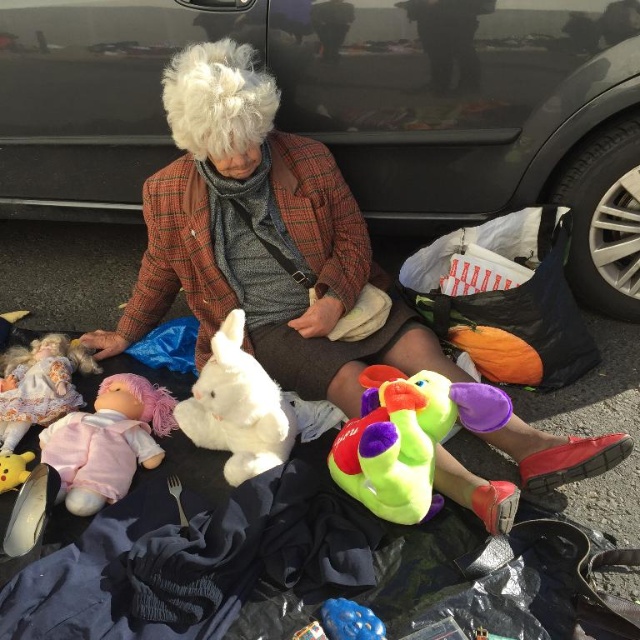
Is the position of plush multicolored toy at lower center more distant than that of matte pink doll at lower left?

That is False.

Who is more distant from viewer, (356,497) or (44,387)?

Point (44,387)

Identify the location of plush multicolored toy at lower center. (406, 436).

Where is `plush multicolored toy at lower center`? Image resolution: width=640 pixels, height=640 pixels. plush multicolored toy at lower center is located at coordinates (406, 436).

Is soft pink fabric doll at lower left positioned behind white plush rabbit at center?

Yes.

Image resolution: width=640 pixels, height=640 pixels. Describe the element at coordinates (108, 442) in the screenshot. I see `soft pink fabric doll at lower left` at that location.

Which is behind, point (61, 492) or point (264, 401)?

Positioned behind is point (61, 492).

Identify the location of soft pink fabric doll at lower left. This screenshot has height=640, width=640. (108, 442).

Does black glossy car at upper center have a lesser width compared to soft pink fabric doll at lower left?

Incorrect, black glossy car at upper center's width is not less than soft pink fabric doll at lower left's.

Who is more forward, [500,20] or [65,433]?

Positioned in front is point [65,433].

At what (x,y) coordinates should I click in order to perform the action: click on black glossy car at upper center. Please return your answer as a coordinate pair (x, y). This screenshot has height=640, width=640. Looking at the image, I should click on (353, 108).